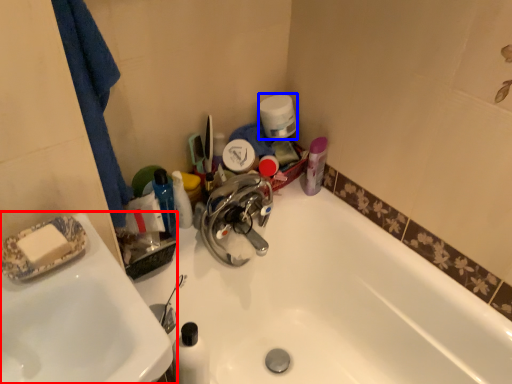
Question: Which of the following is the closest to the observer, sink (highlighted by a red box) or toilet paper (highlighted by a blue box)?

Choices:
 (A) sink
 (B) toilet paper

Answer: (A)